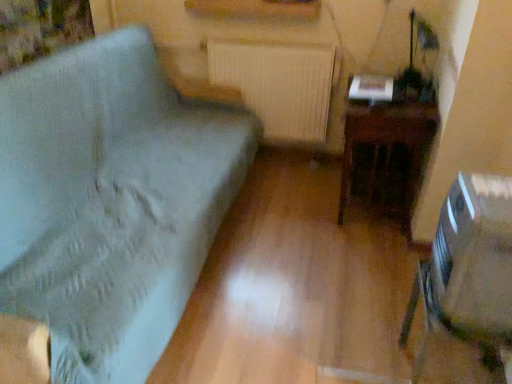
Question: From a real-world perspective, is dark wood table at right positioned above or below light blue fabric cushion at left?

Choices:
 (A) below
 (B) above

Answer: (A)

Question: Looking at the image, does dark wood table at right seem bigger or smaller compared to light blue fabric cushion at left?

Choices:
 (A) big
 (B) small

Answer: (B)

Question: Which object is the closest to the white textured radiator at center?

Choices:
 (A) light blue fabric cushion at left
 (B) dark wood table at right
 (C) clear plastic swivel chair at lower right

Answer: (B)

Question: Which of these objects is positioned closest to the dark wood table at right?

Choices:
 (A) light blue fabric cushion at left
 (B) clear plastic swivel chair at lower right
 (C) white textured radiator at center

Answer: (C)